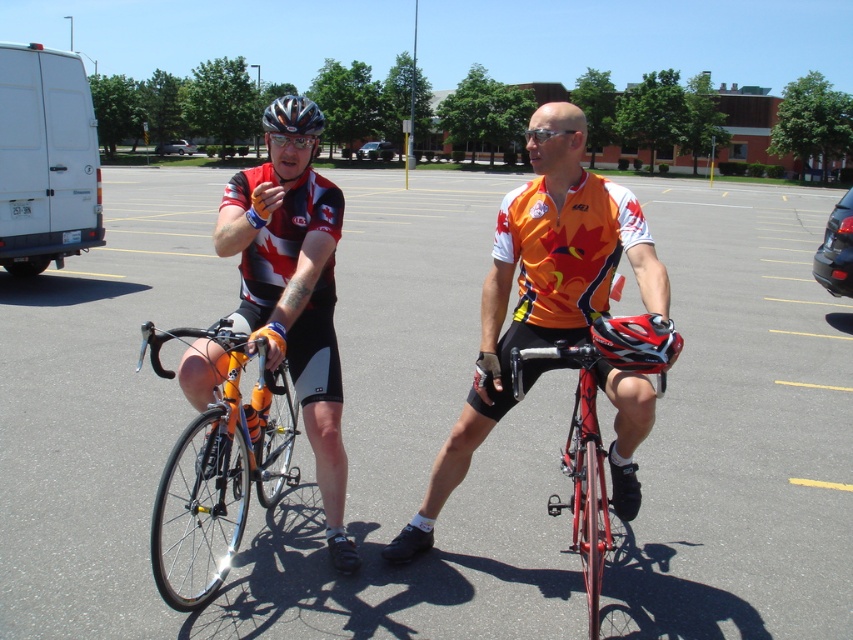
Question: Among these points, which one is nearest to the camera?

Choices:
 (A) (212, 490)
 (B) (289, 122)
 (C) (486, 362)

Answer: (C)

Question: Observing the image, what is the correct spatial positioning of shiny orange frame at center in reference to black matte helmet at center?

Choices:
 (A) below
 (B) above

Answer: (A)

Question: Is gray asphalt parking lot at center wider than matte black helmet at center?

Choices:
 (A) yes
 (B) no

Answer: (A)

Question: Which point is closer to the camera?

Choices:
 (A) matte black goggles at center
 (B) matte black cycling jersey at center

Answer: (B)

Question: Is shiny orange frame at center below matte black helmet at center?

Choices:
 (A) yes
 (B) no

Answer: (A)

Question: Which of the following is the closest to the observer?

Choices:
 (A) orange jersey at center
 (B) shiny red bicycle at center
 (C) matte black goggles at center

Answer: (B)